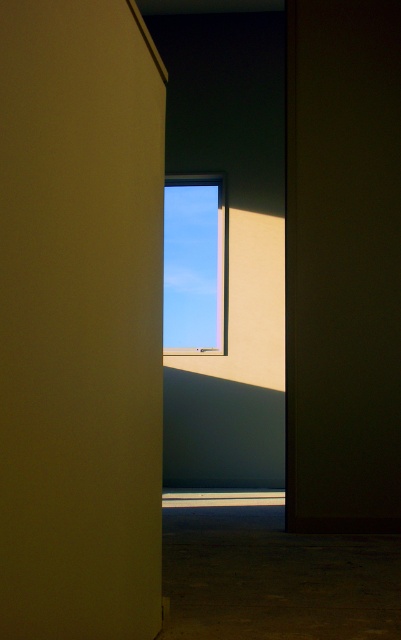
You are standing in a room with a matte yellow door at center and a transparent glass window at center. You want to exit the room through the door but need to avoid direct sunlight coming from the window. Which object should you approach first to exit without getting hit by the sunlight?

The matte yellow door at center is below the transparent glass window at center, so approaching the door first would allow you to exit without getting hit by the sunlight coming from the window above.

You are a delivery person carrying a 4.5 meter long pipe. You need to move it through the space between the matte yellow door at center and the transparent glass window at center. Can the pipe fit through the space between them?

The distance between the matte yellow door at center and the transparent glass window at center is 4.50 meters. Since the pipe is exactly 4.5 meters long, it can just barely fit through the space between them if positioned carefully.

You are standing in a room with a narrow opening between two beige walls. You notice a point marked at coordinates (x=81, y=321). According to the scene description, which object does this point belong to?

The point at (x=81, y=321) is on the matte yellow door at center.